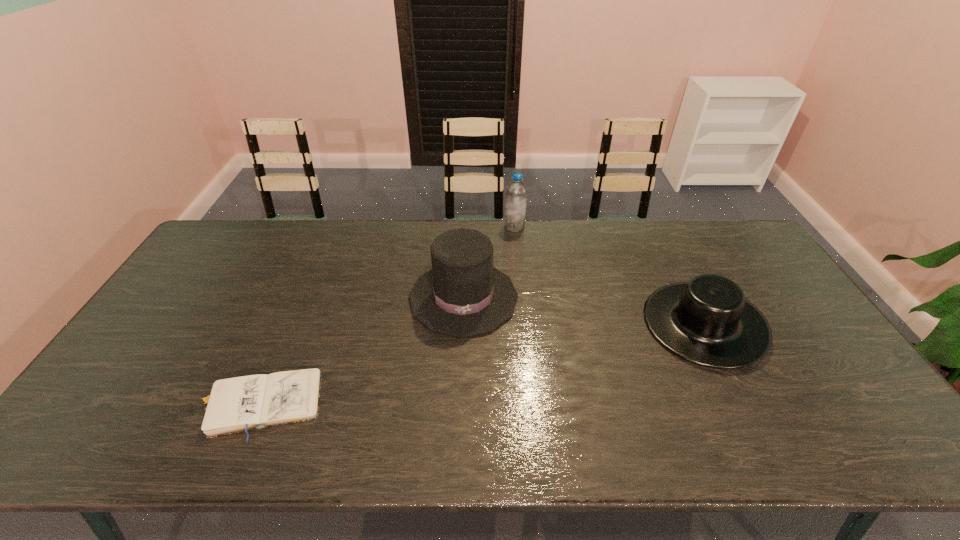
Identify the location of free location that satisfies the following two spatial constraints: 1. on the back side of the shortest object; 2. on the left side of the water bottle. (333, 227).